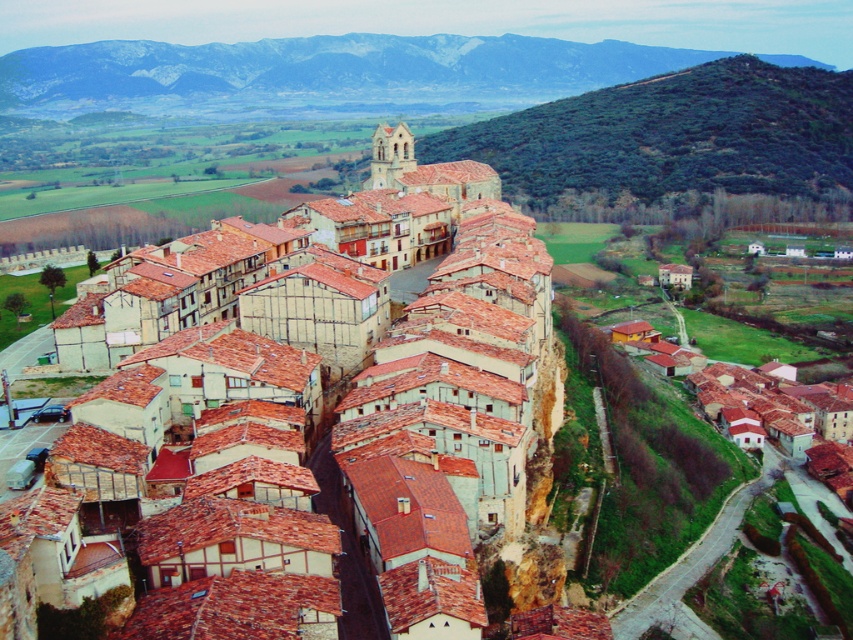
You are standing in the historic town and want to take a photo of both the point at coordinates (x=502, y=228) and the point at coordinates (x=270, y=81). Which point should you focus on first to ensure both are in the frame?

You should focus on point (x=502, y=228) first because it is in front of point (x=270, y=81), so it will be closer to the camera and easier to capture both in the frame.

You are an artist planning to paint the landscape of the historic town. You need to decide which area to focus on first based on their sizes. Which of the two elements, the rocky brown mountain at upper center or the green leafy hillside at upper right, should you paint first if you want to start with the larger one?

The green leafy hillside at upper right is larger than the rocky brown mountain at upper center, so you should start painting the green leafy hillside at upper right first.

You are standing in the valley looking at the historic town. You notice the matte clay roof tiles at center and the rocky brown mountain at upper center. Which object is positioned closer to your viewpoint?

The matte clay roof tiles at center are closer to the viewer than the rocky brown mountain at upper center.